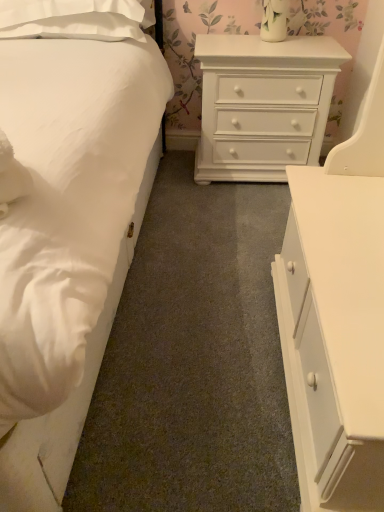
Where is `white soft pillow at upper left`? This screenshot has width=384, height=512. white soft pillow at upper left is located at coordinates (72, 19).

In order to click on white smooth bed at left in this screenshot , I will do click(x=67, y=226).

Locate an element on the screen. The height and width of the screenshot is (512, 384). white painted wood chest of drawers at center, arranged as the 1th chest of drawers when viewed from the back is located at coordinates (263, 105).

Locate an element on the screen. white glossy chest of drawers at upper center, which ranks as the first chest of drawers in front-to-back order is located at coordinates (335, 335).

Is white painted wood chest of drawers at center, arranged as the second chest of drawers when viewed from the front, not near white smooth bed at left?

That's not correct — white painted wood chest of drawers at center, arranged as the second chest of drawers when viewed from the front, is a little close to white smooth bed at left.

From a real-world perspective, is white painted wood chest of drawers at center, arranged as the 1th chest of drawers when viewed from the back, on top of white smooth bed at left?

No, from a real-world perspective, white painted wood chest of drawers at center, arranged as the 1th chest of drawers when viewed from the back, is not above white smooth bed at left.

Is point (275, 74) in front of point (69, 158)?

That is False.

Is point (222, 54) positioned before point (329, 227)?

No, (222, 54) is further to viewer.

Which object is positioned more to the left, white painted wood chest of drawers at center, arranged as the second chest of drawers when viewed from the front, or white glossy chest of drawers at upper center, the second chest of drawers from the back?

From the viewer's perspective, white painted wood chest of drawers at center, arranged as the second chest of drawers when viewed from the front, appears more on the left side.

Measure the distance from white painted wood chest of drawers at center, arranged as the second chest of drawers when viewed from the front, to white glossy chest of drawers at upper center, which ranks as the first chest of drawers in front-to-back order.

white painted wood chest of drawers at center, arranged as the second chest of drawers when viewed from the front, is 36.97 inches away from white glossy chest of drawers at upper center, which ranks as the first chest of drawers in front-to-back order.

Between white painted wood chest of drawers at center, arranged as the second chest of drawers when viewed from the front, and white glossy chest of drawers at upper center, which ranks as the first chest of drawers in front-to-back order, which one has smaller size?

With smaller size is white painted wood chest of drawers at center, arranged as the second chest of drawers when viewed from the front.

How different are the orientations of white glossy chest of drawers at upper center, the second chest of drawers from the back, and white smooth bed at left in degrees?

The facing directions of white glossy chest of drawers at upper center, the second chest of drawers from the back, and white smooth bed at left are 90.8 degrees apart.

Which of these two, white glossy chest of drawers at upper center, which ranks as the first chest of drawers in front-to-back order, or white smooth bed at left, is wider?

white smooth bed at left.

Are white glossy chest of drawers at upper center, the second chest of drawers from the back, and white smooth bed at left beside each other?

They are not placed beside each other.

In terms of height, does white glossy chest of drawers at upper center, the second chest of drawers from the back, look taller or shorter compared to white smooth bed at left?

In the image, white glossy chest of drawers at upper center, the second chest of drawers from the back, appears to be taller than white smooth bed at left.

From the image's perspective, is white smooth bed at left on top of white painted wood chest of drawers at center, arranged as the 1th chest of drawers when viewed from the back?

No, from the image's perspective, white smooth bed at left is not over white painted wood chest of drawers at center, arranged as the 1th chest of drawers when viewed from the back.

How much distance is there between white smooth bed at left and white painted wood chest of drawers at center, arranged as the second chest of drawers when viewed from the front?

white smooth bed at left and white painted wood chest of drawers at center, arranged as the second chest of drawers when viewed from the front, are 25.92 inches apart.

Is white smooth bed at left not within white painted wood chest of drawers at center, arranged as the second chest of drawers when viewed from the front?

That's correct, white smooth bed at left is outside of white painted wood chest of drawers at center, arranged as the second chest of drawers when viewed from the front.

Does white glossy chest of drawers at upper center, which ranks as the first chest of drawers in front-to-back order, lie in front of white soft pillow at upper left?

Yes, white glossy chest of drawers at upper center, which ranks as the first chest of drawers in front-to-back order, is closer to the camera.

How many degrees apart are the facing directions of white glossy chest of drawers at upper center, the second chest of drawers from the back, and white soft pillow at upper left?

The angle between the facing direction of white glossy chest of drawers at upper center, the second chest of drawers from the back, and the facing direction of white soft pillow at upper left is 88.3 degrees.

From a real-world perspective, is white glossy chest of drawers at upper center, the second chest of drawers from the back, physically above white soft pillow at upper left?

Actually, white glossy chest of drawers at upper center, the second chest of drawers from the back, is physically below white soft pillow at upper left in the real world.

The image size is (384, 512). Identify the location of pillow behind the white glossy chest of drawers at upper center, the second chest of drawers from the back. (72, 19).

Find the location of a particular element. the chest of drawers that is behind the white glossy chest of drawers at upper center, the second chest of drawers from the back is located at coordinates pyautogui.click(x=263, y=105).

Looking at this image, could you measure the distance between white glossy chest of drawers at upper center, which ranks as the first chest of drawers in front-to-back order, and white painted wood chest of drawers at center, arranged as the second chest of drawers when viewed from the front?

The distance of white glossy chest of drawers at upper center, which ranks as the first chest of drawers in front-to-back order, from white painted wood chest of drawers at center, arranged as the second chest of drawers when viewed from the front, is 36.97 inches.

From the picture: Does white glossy chest of drawers at upper center, the second chest of drawers from the back, have a greater height compared to white painted wood chest of drawers at center, arranged as the 1th chest of drawers when viewed from the back?

Yes, white glossy chest of drawers at upper center, the second chest of drawers from the back, is taller than white painted wood chest of drawers at center, arranged as the 1th chest of drawers when viewed from the back.

Which is more to the right, white soft pillow at upper left or white glossy chest of drawers at upper center, which ranks as the first chest of drawers in front-to-back order?

white glossy chest of drawers at upper center, which ranks as the first chest of drawers in front-to-back order.

Is white soft pillow at upper left spatially inside white glossy chest of drawers at upper center, which ranks as the first chest of drawers in front-to-back order, or outside of it?

white soft pillow at upper left cannot be found inside white glossy chest of drawers at upper center, which ranks as the first chest of drawers in front-to-back order.

Is point (120, 16) in front of point (363, 417)?

No, it is behind (363, 417).

Is white soft pillow at upper left oriented towards white glossy chest of drawers at upper center, the second chest of drawers from the back?

No, white soft pillow at upper left is not aimed at white glossy chest of drawers at upper center, the second chest of drawers from the back.

Find the location of a particular element. This screenshot has width=384, height=512. chest of drawers below the white smooth bed at left (from a real-world perspective) is located at coordinates (x=263, y=105).

I want to click on chest of drawers on the right of the white painted wood chest of drawers at center, arranged as the second chest of drawers when viewed from the front, so click(x=335, y=335).

From the picture: Which object lies further to the anchor point white smooth bed at left, white painted wood chest of drawers at center, arranged as the second chest of drawers when viewed from the front, or white soft pillow at upper left?

The object further to white smooth bed at left is white painted wood chest of drawers at center, arranged as the second chest of drawers when viewed from the front.

Which object lies further to the anchor point white smooth bed at left, white soft pillow at upper left or white glossy chest of drawers at upper center, which ranks as the first chest of drawers in front-to-back order?

The object further to white smooth bed at left is white glossy chest of drawers at upper center, which ranks as the first chest of drawers in front-to-back order.

Estimate the real-world distances between objects in this image. Which object is further from white smooth bed at left, white soft pillow at upper left or white painted wood chest of drawers at center, arranged as the 1th chest of drawers when viewed from the back?

→ white painted wood chest of drawers at center, arranged as the 1th chest of drawers when viewed from the back, lies further to white smooth bed at left than the other object.

Looking at the image, which one is located closer to white soft pillow at upper left, white smooth bed at left or white painted wood chest of drawers at center, arranged as the 1th chest of drawers when viewed from the back?

Among the two, white smooth bed at left is located nearer to white soft pillow at upper left.

Which object lies further to the anchor point white glossy chest of drawers at upper center, which ranks as the first chest of drawers in front-to-back order, white smooth bed at left or white soft pillow at upper left?

white soft pillow at upper left is positioned further to the anchor white glossy chest of drawers at upper center, which ranks as the first chest of drawers in front-to-back order.

Based on the photo, based on their spatial positions, is white glossy chest of drawers at upper center, the second chest of drawers from the back, or white painted wood chest of drawers at center, arranged as the 1th chest of drawers when viewed from the back, further from white smooth bed at left?

white painted wood chest of drawers at center, arranged as the 1th chest of drawers when viewed from the back, is further to white smooth bed at left.

Considering their positions, is white glossy chest of drawers at upper center, the second chest of drawers from the back, positioned further to white painted wood chest of drawers at center, arranged as the 1th chest of drawers when viewed from the back, than white soft pillow at upper left?

Among the two, white glossy chest of drawers at upper center, the second chest of drawers from the back, is located further to white painted wood chest of drawers at center, arranged as the 1th chest of drawers when viewed from the back.

From the picture: From the image, which object appears to be nearer to white smooth bed at left, white painted wood chest of drawers at center, arranged as the second chest of drawers when viewed from the front, or white glossy chest of drawers at upper center, the second chest of drawers from the back?

white glossy chest of drawers at upper center, the second chest of drawers from the back, lies closer to white smooth bed at left than the other object.

Identify the location of pillow positioned between white smooth bed at left and white painted wood chest of drawers at center, arranged as the second chest of drawers when viewed from the front, from near to far. (72, 19).

I want to click on the chest of drawers located between white smooth bed at left and white painted wood chest of drawers at center, arranged as the 1th chest of drawers when viewed from the back, in the depth direction, so click(335, 335).

At what (x,y) coordinates should I click in order to perform the action: click on chest of drawers between white smooth bed at left and white soft pillow at upper left in the front-back direction. Please return your answer as a coordinate pair (x, y). This screenshot has height=512, width=384. Looking at the image, I should click on (335, 335).

The image size is (384, 512). Find the location of `pillow positioned between white glossy chest of drawers at upper center, the second chest of drawers from the back, and white painted wood chest of drawers at center, arranged as the second chest of drawers when viewed from the front, from near to far`. pillow positioned between white glossy chest of drawers at upper center, the second chest of drawers from the back, and white painted wood chest of drawers at center, arranged as the second chest of drawers when viewed from the front, from near to far is located at coordinates (72, 19).